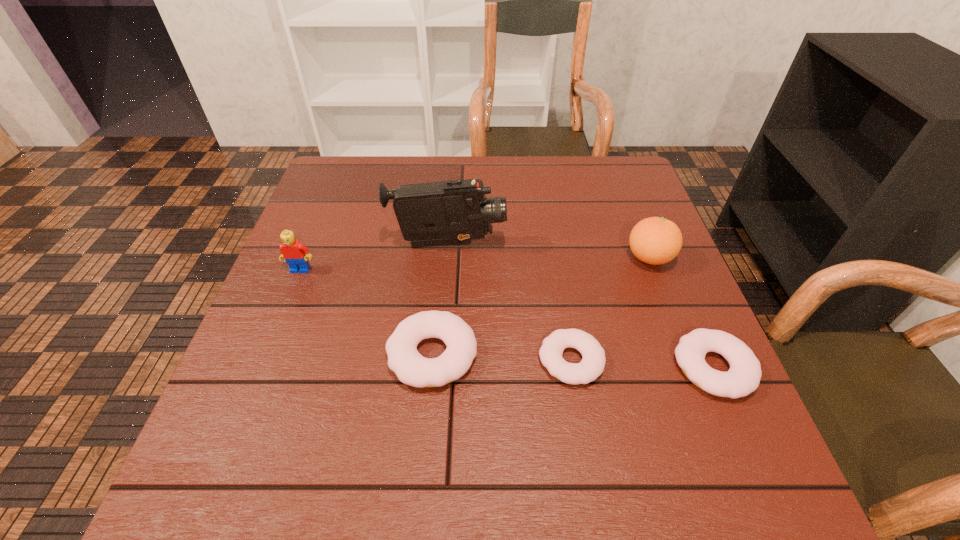
You are a GUI agent. You are given a task and a screenshot of the screen. Output one action in this format:
    pyautogui.click(x=<x>, y=<y>)
    Task: Click on the vacant point at the left edge
    
    Given the screenshot: What is the action you would take?
    pyautogui.click(x=277, y=377)

Identify the location of free location at the right edge of the desktop. (641, 266).

Image resolution: width=960 pixels, height=540 pixels. What are the coordinates of `vacant area at the far left corner of the desktop` in the screenshot? It's located at (369, 192).

The image size is (960, 540). I want to click on free space at the near left corner of the desktop, so click(310, 417).

The image size is (960, 540). What are the coordinates of `free region at the far right corner of the desktop` in the screenshot? It's located at click(x=588, y=171).

Locate an element on the screen. free space between the tallest object and the orange is located at coordinates (548, 251).

In order to click on vacant space that is in between the leftmost doughnut and the leftmost object in this screenshot , I will do `click(367, 312)`.

Identify the location of vacant space that's between the orange and the fifth tallest object. (682, 313).

The width and height of the screenshot is (960, 540). I want to click on blank region between the camcorder and the leftmost doughnut, so click(x=440, y=299).

This screenshot has width=960, height=540. What are the coordinates of `free space between the camcorder and the rightmost doughnut` in the screenshot? It's located at click(581, 306).